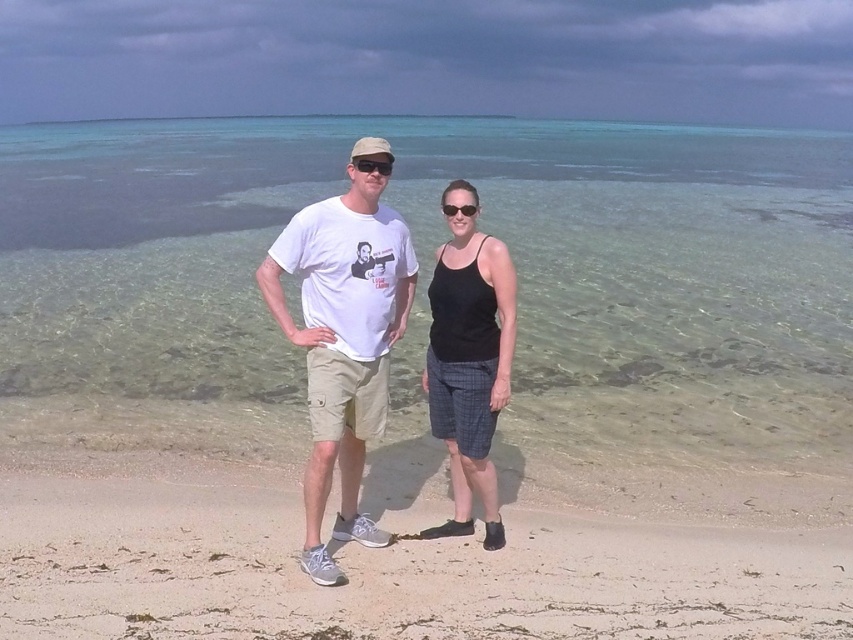
Describe the element at coordinates (402, 563) in the screenshot. Image resolution: width=853 pixels, height=640 pixels. I see `light beige sand at center` at that location.

Who is positioned more to the left, light beige sand at center or black plastic sunglasses at center?

Positioned to the left is light beige sand at center.

Does point (798, 609) lie in front of point (447, 216)?

Yes, point (798, 609) is closer to viewer.

Where is `light beige sand at center`? This screenshot has height=640, width=853. light beige sand at center is located at coordinates (402, 563).

Which of these two, white cotton t-shirt at center or black woven shorts at center, stands taller?

white cotton t-shirt at center is taller.

This screenshot has height=640, width=853. Identify the location of white cotton t-shirt at center. (343, 339).

Where is `white cotton t-shirt at center`? The height and width of the screenshot is (640, 853). white cotton t-shirt at center is located at coordinates (343, 339).

Who is lower down, black woven shorts at center or black matte sunglasses at center?

Positioned lower is black woven shorts at center.

Image resolution: width=853 pixels, height=640 pixels. What do you see at coordinates (469, 365) in the screenshot? I see `black woven shorts at center` at bounding box center [469, 365].

This screenshot has width=853, height=640. What do you see at coordinates (469, 365) in the screenshot?
I see `black woven shorts at center` at bounding box center [469, 365].

The image size is (853, 640). Identify the location of black woven shorts at center. (469, 365).